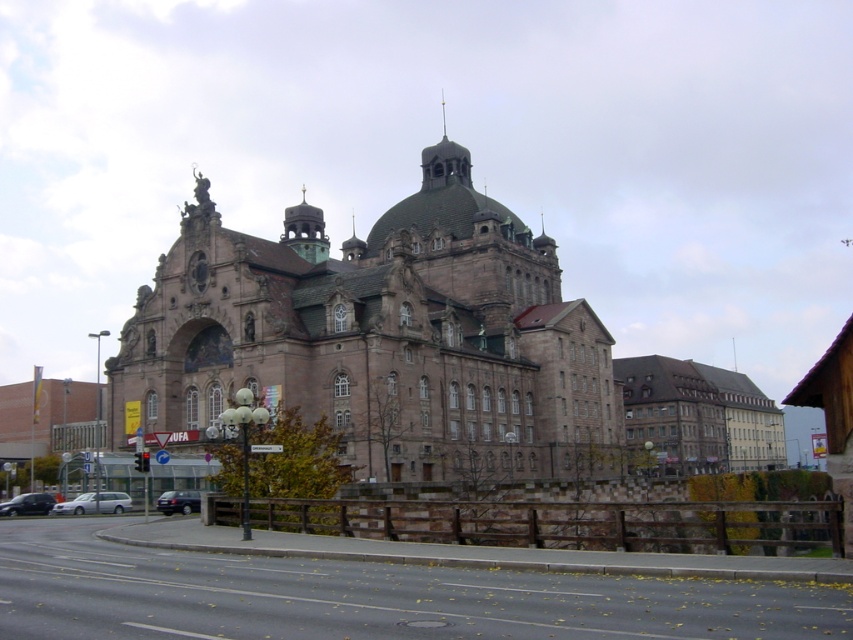
Question: Does black glossy car at lower left appear over dark gray metallic car at lower left?

Choices:
 (A) no
 (B) yes

Answer: (A)

Question: Does brown stone church at center have a larger size compared to dark gray metallic car at lower left?

Choices:
 (A) no
 (B) yes

Answer: (B)

Question: Which point is farther from the camera taking this photo?

Choices:
 (A) (4, 512)
 (B) (106, 496)
 (C) (364, 419)
 (D) (192, 493)

Answer: (A)

Question: Which point is closer to the camera taking this photo?

Choices:
 (A) (102, 502)
 (B) (199, 419)
 (C) (167, 506)

Answer: (C)

Question: Can you confirm if brown stone church at center is bigger than dark gray metallic car at lower left?

Choices:
 (A) yes
 (B) no

Answer: (A)

Question: Based on their relative distances, which object is nearer to the silver metallic car at lower left?

Choices:
 (A) dark gray metallic car at lower left
 (B) black glossy car at lower left
 (C) brown stone church at center

Answer: (B)